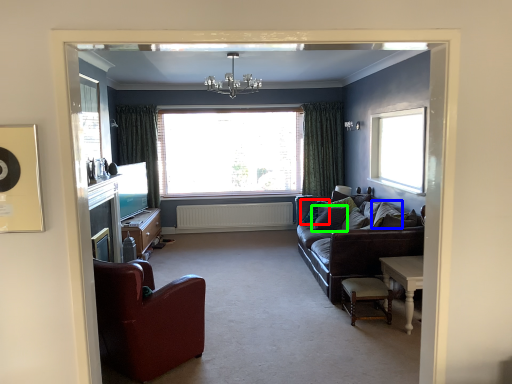
Question: Which is nearer to the pillow (highlighted by a red box)? pillow (highlighted by a blue box) or pillow (highlighted by a green box).

Choices:
 (A) pillow
 (B) pillow

Answer: (B)